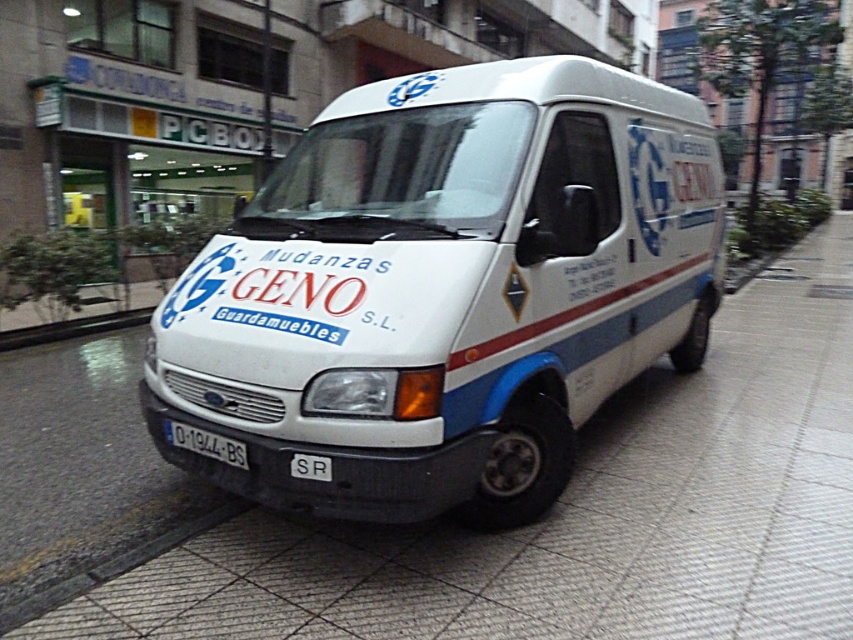
In the scene shown: You are standing at the point marked by coordinates point (445, 291). Based on the scene, what object are you directly in front of?

The point (445, 291) corresponds to the white matte van at center, so you are directly in front of the white matte van at center.